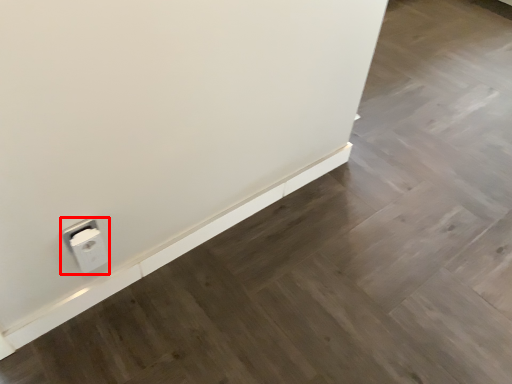
Question: From the image's perspective, considering the relative positions of power plugs and sockets (annotated by the red box) and ledge in the image provided, where is power plugs and sockets (annotated by the red box) located with respect to the staircase?

Choices:
 (A) above
 (B) below

Answer: (B)